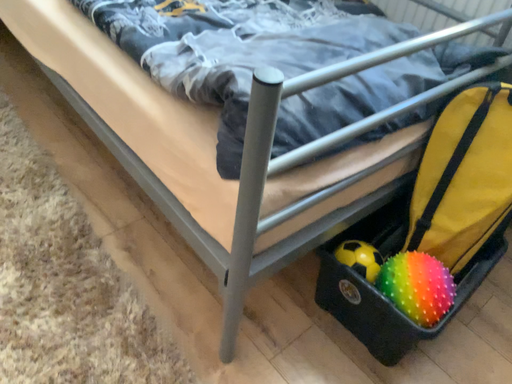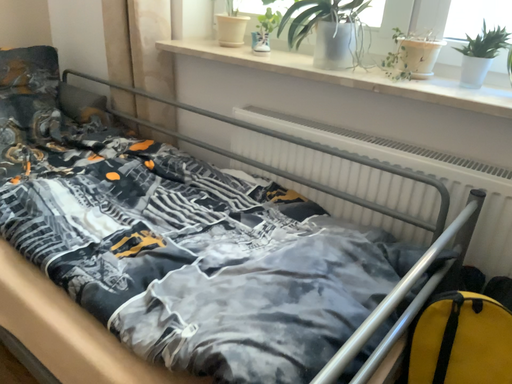
Question: Which way did the camera rotate in the video?

Choices:
 (A) rotated right
 (B) rotated left

Answer: (A)